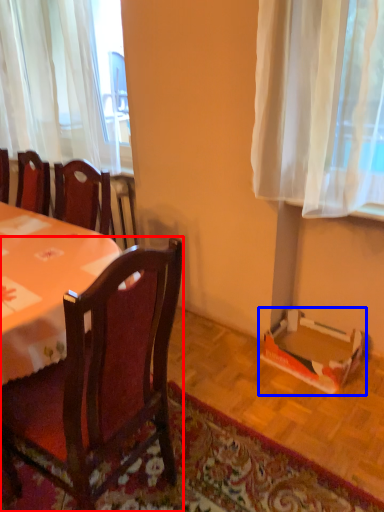
Question: Which of the following is the closest to the observer, chair (highlighted by a red box) or cardboard box (highlighted by a blue box)?

Choices:
 (A) chair
 (B) cardboard box

Answer: (A)